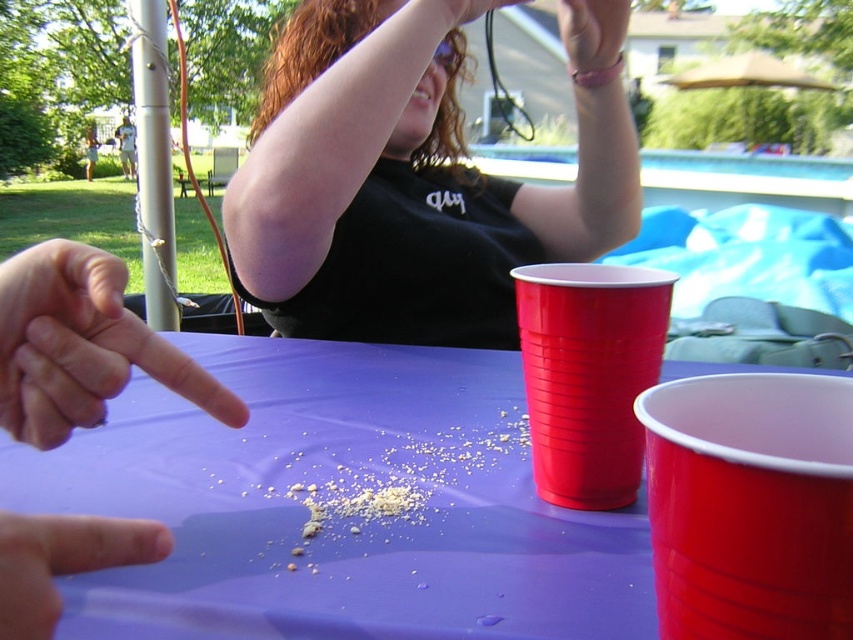
Question: Can you confirm if purple plastic table at center is bigger than flesh-toned skin finger at lower left?

Choices:
 (A) no
 (B) yes

Answer: (B)

Question: Which point is farther to the camera?

Choices:
 (A) (775, 557)
 (B) (643, 298)
 (C) (415, 321)
 (D) (457, 13)

Answer: (C)

Question: Is black matte shirt at upper center below flesh-toned skin finger at lower left?

Choices:
 (A) yes
 (B) no

Answer: (B)

Question: Which object is positioned farthest from the matte black bracelet at upper center?

Choices:
 (A) flesh-toned skin finger at lower left
 (B) matte plastic cup at center right
 (C) pink flesh-toned finger at center-left

Answer: (A)

Question: Can you confirm if black matte shirt at upper center is positioned below matte black hand at upper center?

Choices:
 (A) no
 (B) yes

Answer: (B)

Question: Based on their relative distances, which object is nearer to the purple plastic table at center?

Choices:
 (A) matte plastic cup at center right
 (B) flesh-toned skin finger at lower left

Answer: (A)